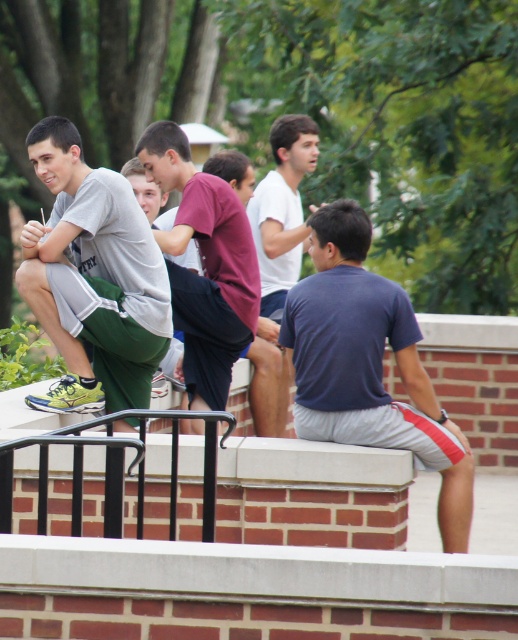
You are a photographer trying to capture a group shot of the matte maroon shirt at center and the white matte shirt at center. Which person should you position to the left in the frame to match their actual arrangement?

The matte maroon shirt at center should be positioned to the left of the white matte shirt at center in the frame to match their actual arrangement.